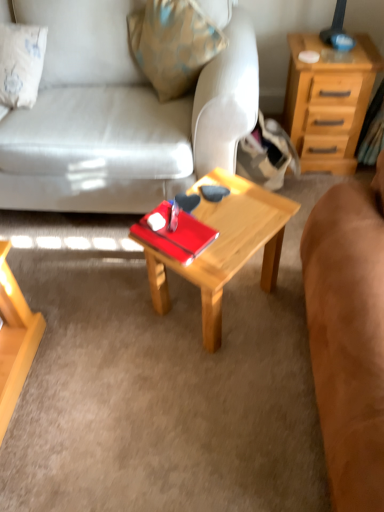
Where is `blank space to the left of brown suede couch at center, which is the 2th studio couch in left-to-right order`? This screenshot has width=384, height=512. blank space to the left of brown suede couch at center, which is the 2th studio couch in left-to-right order is located at coordinates (180, 390).